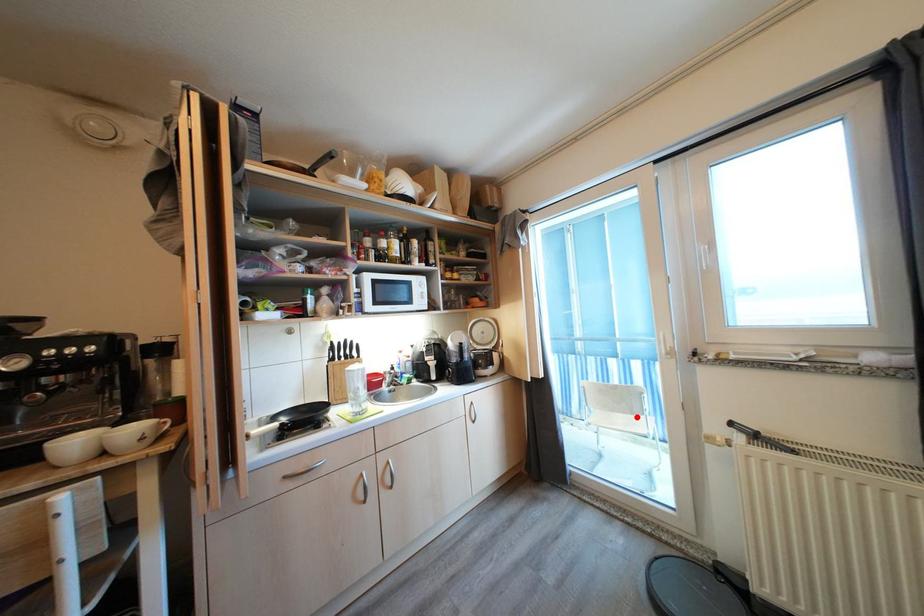
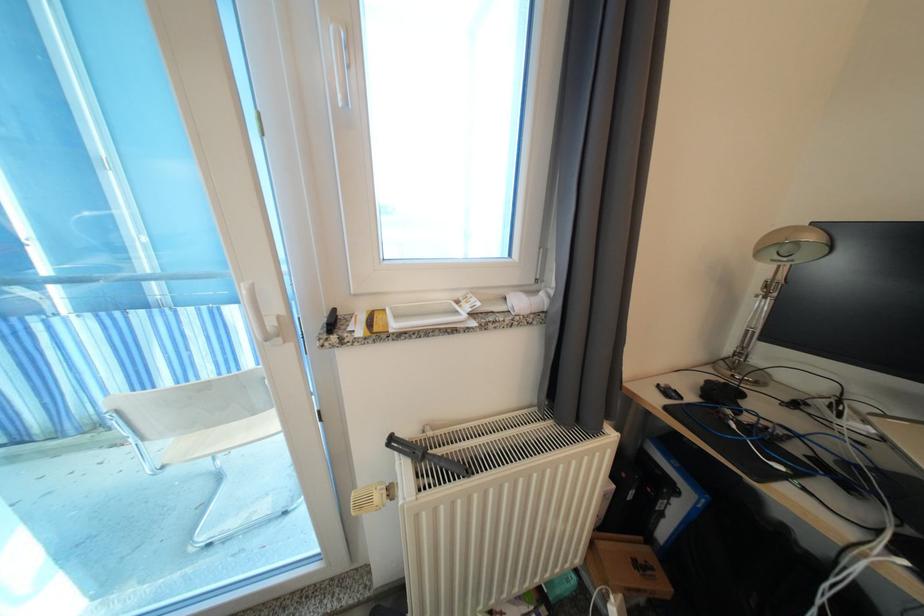
In the second image, find the point that corresponds to the highlighted location in the first image.

(259, 416)